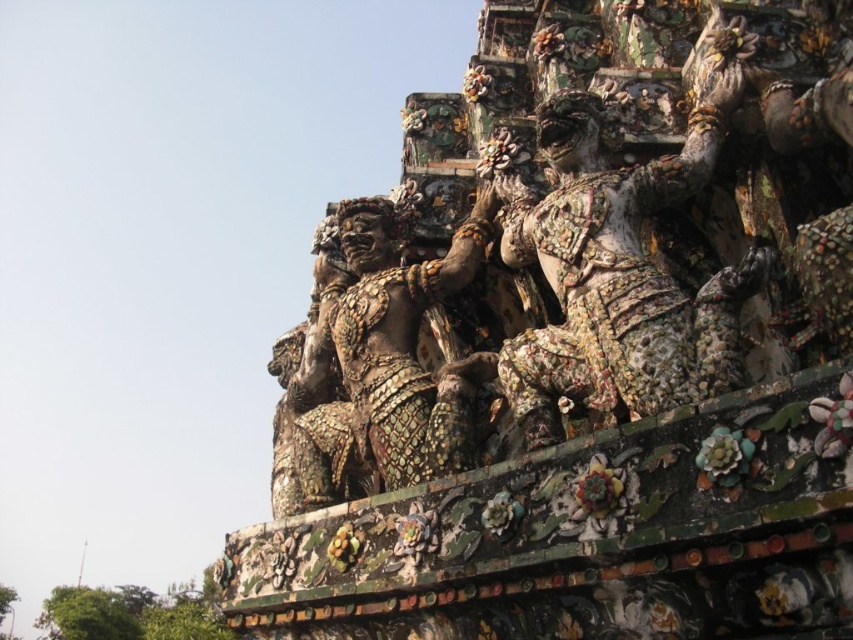
Does multicolored mosaic warrior at center lie behind gold mosaic statue at center?

No.

Measure the distance between multicolored mosaic warrior at center and gold mosaic statue at center.

multicolored mosaic warrior at center is 12.71 meters away from gold mosaic statue at center.

Image resolution: width=853 pixels, height=640 pixels. I want to click on multicolored mosaic warrior at center, so click(619, 273).

Locate an element on the screen. multicolored mosaic warrior at center is located at coordinates (619, 273).